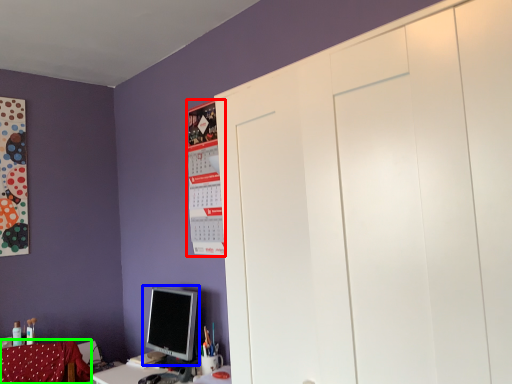
Question: Which object is the closest to the bulletin board (highlighted by a red box)? Choose among these: computer monitor (highlighted by a blue box) or swivel chair (highlighted by a green box).

Choices:
 (A) computer monitor
 (B) swivel chair

Answer: (A)